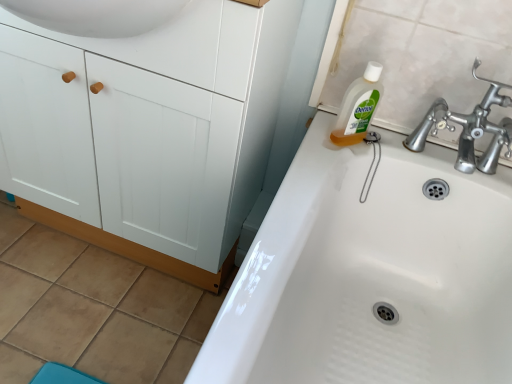
Question: In terms of height, does clear liquid soap at upper right look taller or shorter compared to white matte cabinet at left?

Choices:
 (A) short
 (B) tall

Answer: (A)

Question: Relative to white matte cabinet at left, is clear liquid soap at upper right in front or behind?

Choices:
 (A) front
 (B) behind

Answer: (B)

Question: Which object is positioned closest to the white glossy sink at upper right?

Choices:
 (A) white matte cabinet at left
 (B) clear liquid soap at upper right

Answer: (B)

Question: Based on their relative distances, which object is nearer to the white matte cabinet at left?

Choices:
 (A) clear liquid soap at upper right
 (B) white glossy sink at upper right

Answer: (B)